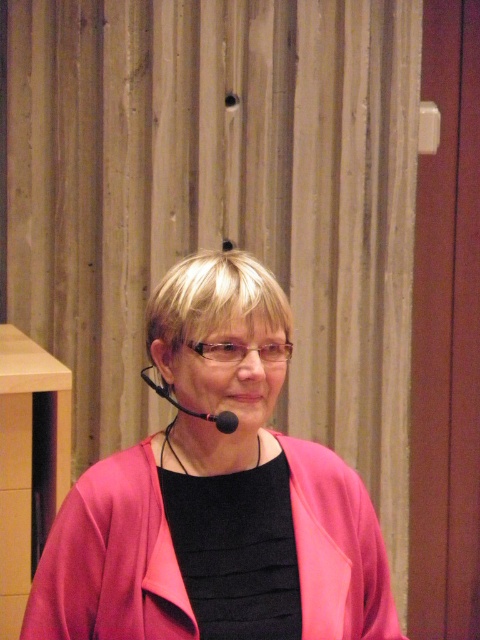
Question: Is pink matte jacket at center bigger than wooden stool at left?

Choices:
 (A) no
 (B) yes

Answer: (A)

Question: Does pink matte jacket at center have a smaller size compared to wooden stool at left?

Choices:
 (A) yes
 (B) no

Answer: (A)

Question: Can you confirm if pink matte jacket at center is wider than wooden stool at left?

Choices:
 (A) yes
 (B) no

Answer: (A)

Question: Among these points, which one is farthest from the camera?

Choices:
 (A) (262, 556)
 (B) (23, 365)

Answer: (B)

Question: Which of the following is the farthest from the observer?

Choices:
 (A) (0, 422)
 (B) (229, 288)

Answer: (A)